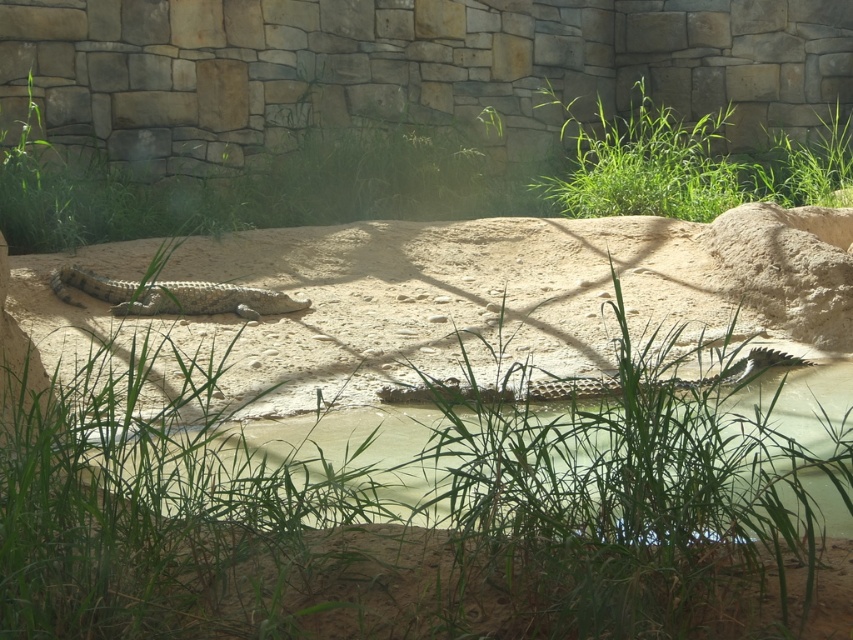
You are a zookeeper who needs to locate the leathery brown crocodile at center in the crocodile enclosure. According to the coordinates provided, where exactly is the crocodile positioned in the enclosure?

The leathery brown crocodile at center is positioned at the coordinates point (173, 296) in the enclosure.